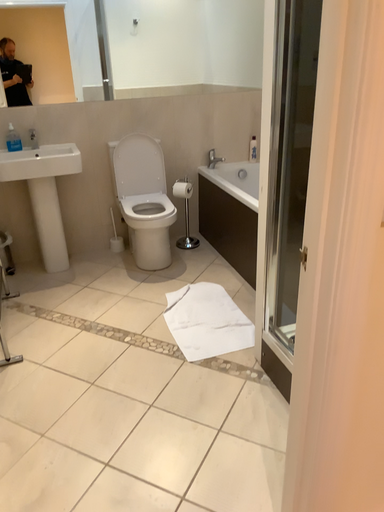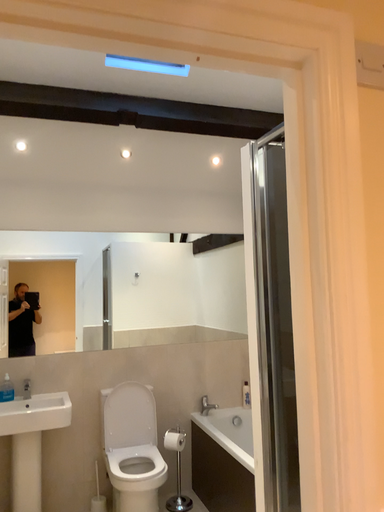
Question: How did the camera likely rotate when shooting the video?

Choices:
 (A) rotated upward
 (B) rotated downward

Answer: (A)